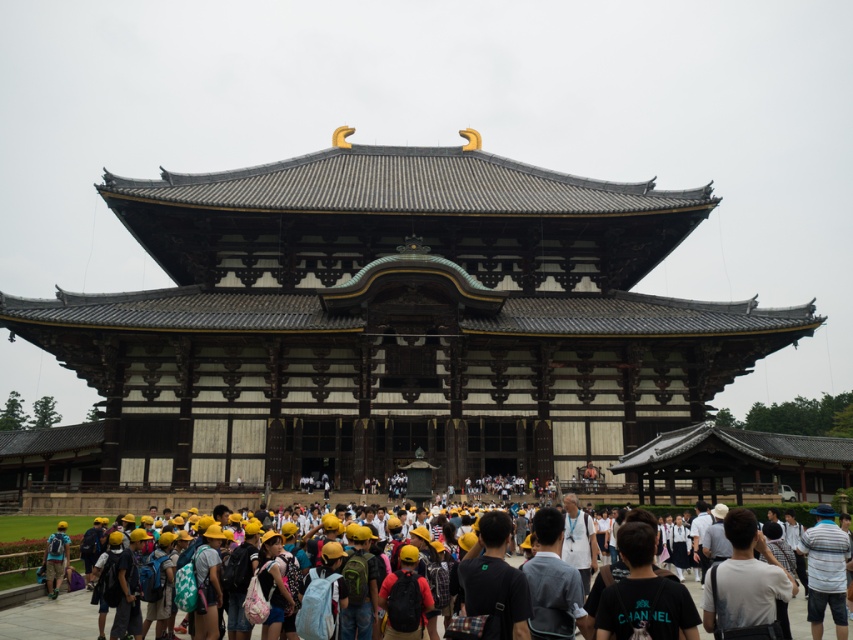
Question: Can you confirm if dark brown wooden temple at center is wider than white cotton shirt at center?

Choices:
 (A) no
 (B) yes

Answer: (B)

Question: Which point is closer to the camera?

Choices:
 (A) (148, 436)
 (B) (722, 588)

Answer: (B)

Question: Is dark brown wooden temple at center further to camera compared to white cotton shirt at center?

Choices:
 (A) no
 (B) yes

Answer: (B)

Question: Which point is farther from the camera taking this photo?

Choices:
 (A) (264, 221)
 (B) (704, 600)

Answer: (A)

Question: Can you confirm if dark brown wooden temple at center is positioned below white cotton shirt at center?

Choices:
 (A) yes
 (B) no

Answer: (B)